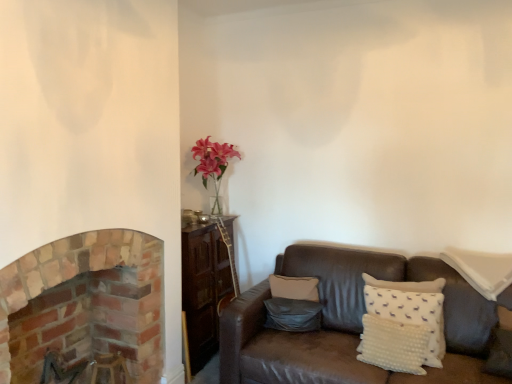
Question: From a real-world perspective, is white dotted pillow at lower right, which is the second pillow in right-to-left order, positioned above or below brick fireplace at left?

Choices:
 (A) above
 (B) below

Answer: (B)

Question: In the image, is white dotted pillow at lower right, which is the second pillow in right-to-left order, on the left side or the right side of brick fireplace at left?

Choices:
 (A) left
 (B) right

Answer: (B)

Question: Based on their relative distances, which object is farther from the white dotted pillow at lower right, which is the second pillow in left-to-right order?

Choices:
 (A) brick fireplace at left
 (B) matte gray pillow at center, which ranks as the first pillow in left-to-right order
 (C) white dotted pillow at right, which is the first pillow in right-to-left order

Answer: (A)

Question: Considering the real-world distances, which object is farthest from the white dotted pillow at right, the third pillow positioned from the left?

Choices:
 (A) matte gray pillow at center, which ranks as the first pillow in left-to-right order
 (B) brick fireplace at left
 (C) white dotted pillow at lower right, which is the second pillow in left-to-right order

Answer: (B)